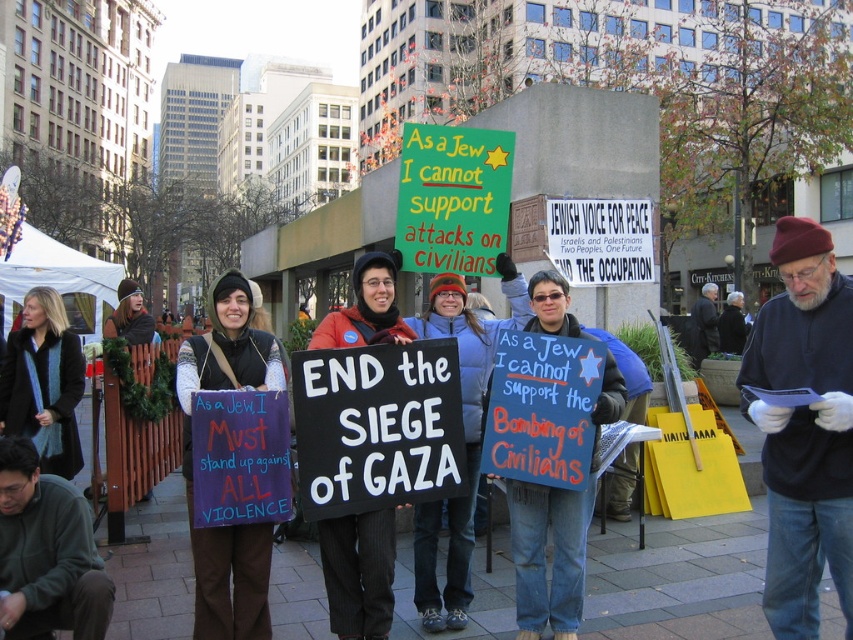
Question: Which object is the farthest from the purple fabric sign at center?

Choices:
 (A) dark blue sweater at center
 (B) black pinstripe pants at center

Answer: (A)

Question: Which of the following is the farthest from the observer?

Choices:
 (A) (344, 604)
 (B) (822, 300)
 (C) (524, 508)

Answer: (C)

Question: Considering the relative positions of dark blue sweater at center and blue fabric sign at center in the image provided, where is dark blue sweater at center located with respect to blue fabric sign at center?

Choices:
 (A) above
 (B) below

Answer: (A)

Question: Can you confirm if purple fabric sign at center is wider than black pinstripe pants at center?

Choices:
 (A) no
 (B) yes

Answer: (B)

Question: Which point is closer to the camera?

Choices:
 (A) blue fabric sign at center
 (B) dark blue sweater at center

Answer: (B)

Question: Is dark blue sweater at center below purple fabric sign at center?

Choices:
 (A) yes
 (B) no

Answer: (B)